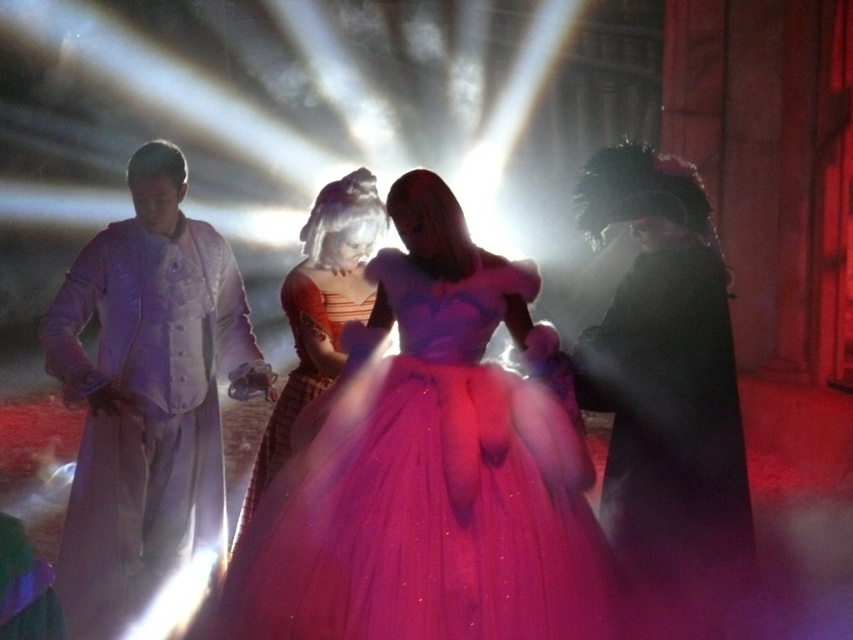
You are a stagehand trying to adjust the lighting for the performance. You need to position a spotlight on the sparkly tulle dress at center and the matte orange dress at center. Which dress should you aim the spotlight at first if you start from the top and move downward?

You should aim the spotlight at the matte orange dress at center first because it is located above the sparkly tulle dress at center.

You are a stagehand standing 10 feet away from the front of the stage. You need to reach the matte white coat at left to adjust its position. Can you reach it without moving closer?

The matte white coat at left is 9.16 feet away from the viewer, so yes, you can reach it without moving closer since you are already 10 feet away from the front of the stage.

You are a stagehand preparing to adjust the lighting for a performance. You notice the sparkly tulle dress at center and the matte white coat at left. Which object requires a spotlight with a narrower beam to avoid illuminating unintended areas, based on their sizes?

The sparkly tulle dress at center has a lesser height compared to the matte white coat at left, so it requires a spotlight with a narrower beam to avoid illuminating unintended areas.